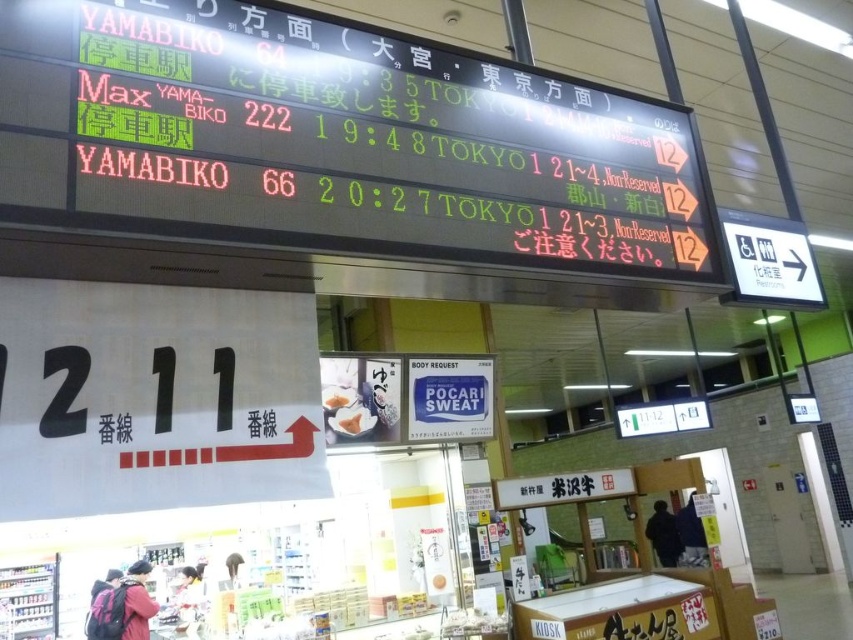
Question: Observing the image, what is the correct spatial positioning of blue plastic sign at center in reference to white matte bread at center?

Choices:
 (A) below
 (B) above

Answer: (B)

Question: Considering the relative positions of led electronic board at upper center and white matte bread at center in the image provided, where is led electronic board at upper center located with respect to white matte bread at center?

Choices:
 (A) below
 (B) above

Answer: (B)

Question: Which object is positioned closest to the white paper bag at center?

Choices:
 (A) white matte bread at center
 (B) blue plastic sign at center

Answer: (A)

Question: Among these points, which one is farthest from the camera?

Choices:
 (A) (351, 424)
 (B) (309, 74)
 (C) (482, 358)

Answer: (C)

Question: Which object appears farthest from the camera in this image?

Choices:
 (A) blue plastic sign at center
 (B) white matte bread at center
 (C) white paper bag at center
 (D) led electronic board at upper center

Answer: (A)

Question: In this image, where is white matte bread at center located relative to white paper bag at center?

Choices:
 (A) below
 (B) above

Answer: (A)